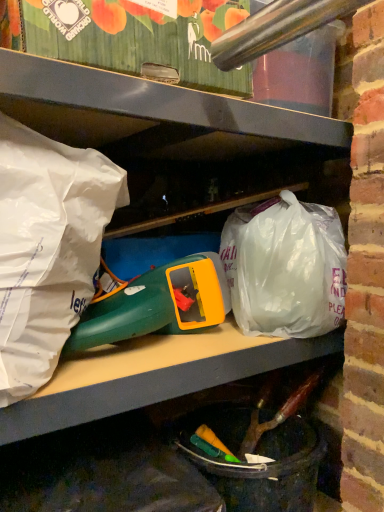
Question: Which direction should I rotate to look at translucent plastic bag at center, which is the 1th plastic bag from back to front, — up or down?

Choices:
 (A) down
 (B) up

Answer: (A)

Question: Is the depth of translucent plastic bag at center, which is the second plastic bag from left to right, greater than that of white paper bag at left, which is the second plastic bag in back-to-front order?

Choices:
 (A) no
 (B) yes

Answer: (B)

Question: Is translucent plastic bag at center, acting as the 2th plastic bag starting from the front, to the right of white paper bag at left, placed as the 1th plastic bag when sorted from left to right, from the viewer's perspective?

Choices:
 (A) yes
 (B) no

Answer: (A)

Question: Can you confirm if translucent plastic bag at center, which is the 1th plastic bag from back to front, is taller than white paper bag at left, which is the second plastic bag in back-to-front order?

Choices:
 (A) yes
 (B) no

Answer: (B)

Question: Does translucent plastic bag at center, acting as the 2th plastic bag starting from the front, have a smaller size compared to white paper bag at left, which is the second plastic bag in back-to-front order?

Choices:
 (A) yes
 (B) no

Answer: (B)

Question: Is white paper bag at left, the second plastic bag positioned from the right, surrounded by translucent plastic bag at center, acting as the 2th plastic bag starting from the front?

Choices:
 (A) no
 (B) yes

Answer: (A)

Question: Can you confirm if translucent plastic bag at center, acting as the 2th plastic bag starting from the front, is positioned to the left of white paper bag at left, placed as the 1th plastic bag when sorted from left to right?

Choices:
 (A) yes
 (B) no

Answer: (B)

Question: Can you confirm if translucent plastic bag at center, which is the second plastic bag from left to right, is thinner than green plastic toy at center?

Choices:
 (A) yes
 (B) no

Answer: (B)

Question: Can we say translucent plastic bag at center, the 1th plastic bag viewed from the right, lies outside green plastic toy at center?

Choices:
 (A) no
 (B) yes

Answer: (B)

Question: Is translucent plastic bag at center, which is the second plastic bag from left to right, placed right next to green plastic toy at center?

Choices:
 (A) yes
 (B) no

Answer: (B)

Question: Is translucent plastic bag at center, which is the 1th plastic bag from back to front, oriented away from green plastic toy at center?

Choices:
 (A) yes
 (B) no

Answer: (B)

Question: From a real-world perspective, is translucent plastic bag at center, the 1th plastic bag viewed from the right, below green plastic toy at center?

Choices:
 (A) yes
 (B) no

Answer: (B)

Question: From a real-world perspective, is translucent plastic bag at center, which is the 1th plastic bag from back to front, over green plastic toy at center?

Choices:
 (A) yes
 (B) no

Answer: (A)

Question: Can you confirm if green plastic toy at center is wider than translucent plastic bag at center, the 1th plastic bag viewed from the right?

Choices:
 (A) no
 (B) yes

Answer: (A)